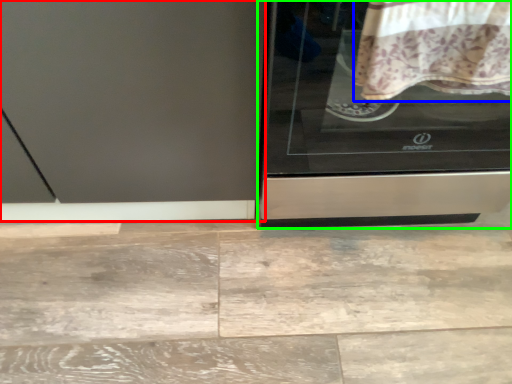
Question: Which object is the farthest from screen door (highlighted by a red box)? Choose among these: blanket (highlighted by a blue box) or home appliance (highlighted by a green box).

Choices:
 (A) blanket
 (B) home appliance

Answer: (A)